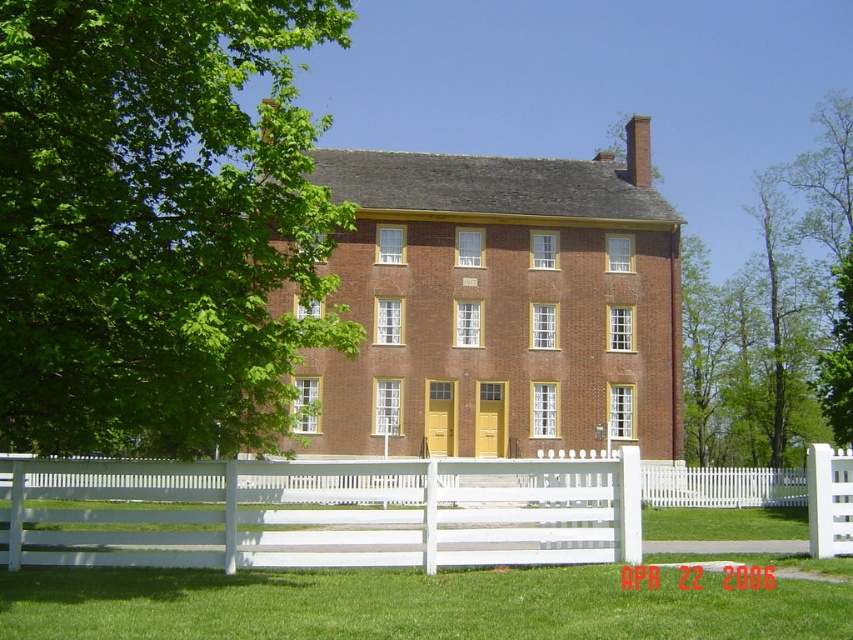
Question: Does green leafy tree at left appear on the right side of white wooden fence at lower center?

Choices:
 (A) yes
 (B) no

Answer: (B)

Question: Is green leafy tree at left wider than white wooden fence at lower center?

Choices:
 (A) no
 (B) yes

Answer: (B)

Question: Which point is closer to the camera taking this photo?

Choices:
 (A) (85, 380)
 (B) (183, 554)

Answer: (A)

Question: Is green leafy tree at left closer to camera compared to white wooden fence at lower center?

Choices:
 (A) no
 (B) yes

Answer: (B)